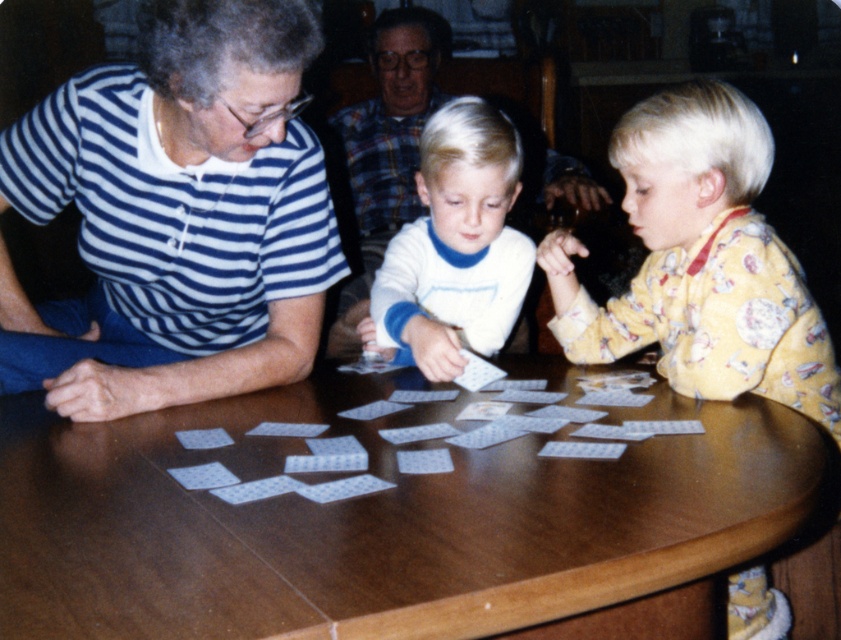
Where is `wooden table at center`? wooden table at center is located at coordinates (393, 524).

Is point (773, 420) less distant than point (553, 408)?

That is True.

This screenshot has width=841, height=640. Identify the location of wooden table at center. (393, 524).

Can you confirm if white soft cotton shirt at center is smaller than translucent plastic cards at center?

Incorrect, white soft cotton shirt at center is not smaller in size than translucent plastic cards at center.

Locate an element on the screen. white soft cotton shirt at center is located at coordinates (455, 246).

Does wooden table at center have a greater width compared to blue striped shirt at left?

Indeed, wooden table at center has a greater width compared to blue striped shirt at left.

How far apart are wooden table at center and blue striped shirt at left?

wooden table at center and blue striped shirt at left are 13.08 inches apart.

Describe the element at coordinates (393, 524) in the screenshot. The width and height of the screenshot is (841, 640). I see `wooden table at center` at that location.

At what (x,y) coordinates should I click in order to perform the action: click on wooden table at center. Please return your answer as a coordinate pair (x, y). Looking at the image, I should click on (393, 524).